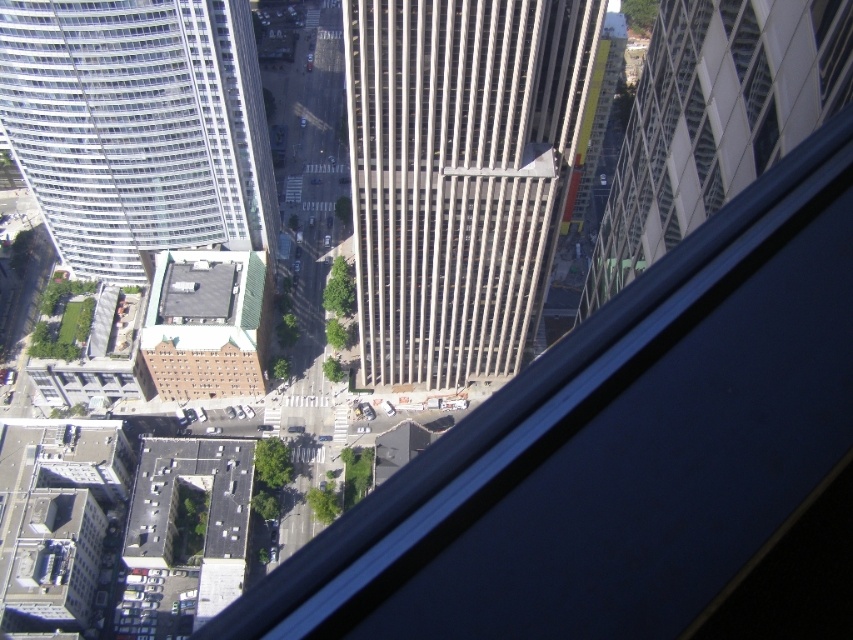
Consider the image. You are an urban planner reviewing this architectural design. You need to determine if the gray concrete skyscraper at center will block sunlight from reaching the white glass building at upper left. Based on their heights, what can you conclude?

The gray concrete skyscraper at center is taller than the white glass building at upper left, so it could potentially block sunlight from reaching the white glass building at upper left depending on their positions.

From the picture: Based on the scene described, if you were standing at the window of the building where this view is taken, which direction would the gray concrete skyscraper at center be relative to the white glass building at upper left?

The gray concrete skyscraper at center is to the right of the white glass building at upper left.